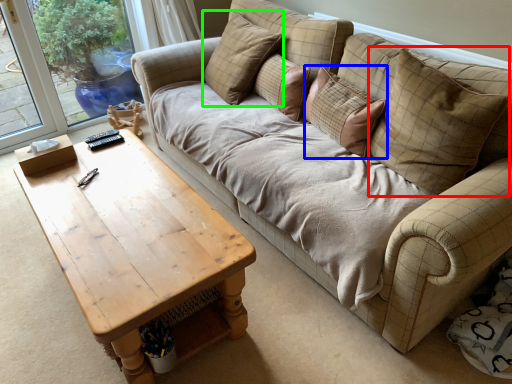
Question: Estimate the real-world distances between objects in this image. Which object is closer to pillow (highlighted by a red box), pillow (highlighted by a blue box) or pillow (highlighted by a green box)?

Choices:
 (A) pillow
 (B) pillow

Answer: (A)